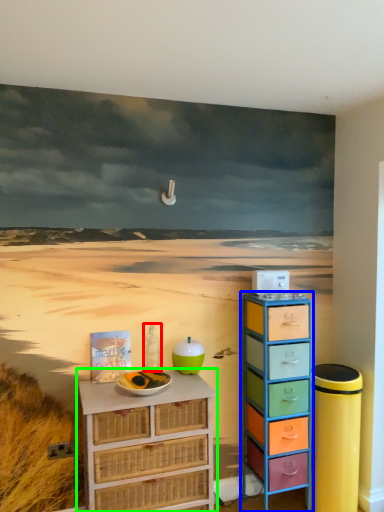
Question: Considering the real-world distances, which object is closest to bottle (highlighted by a red box)? chest of drawers (highlighted by a blue box) or chest of drawers (highlighted by a green box).

Choices:
 (A) chest of drawers
 (B) chest of drawers

Answer: (B)